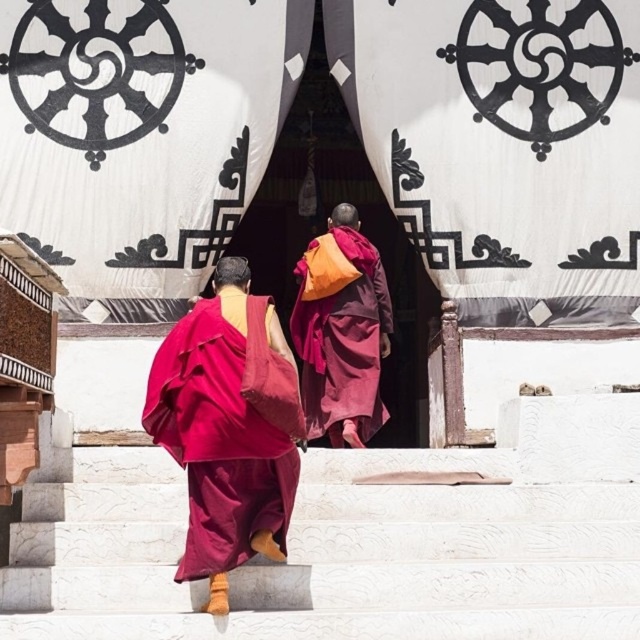
You are a photographer standing at the bottom of the steps observing the two monks in maroon silk robe at center and maroon woolen robe at center. Which robe is positioned lower on the steps?

The maroon silk robe at center is below the maroon woolen robe at center, so the maroon silk robe at center is positioned lower on the steps.